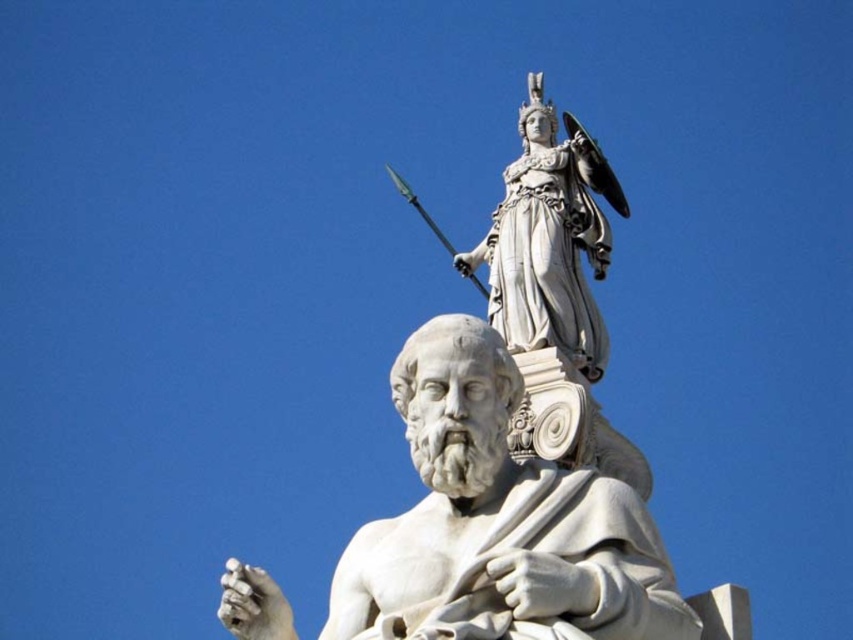
You are standing in front of the two statues. The point marked at coordinates (497, 522) is part of which statue?

The point marked at coordinates (497, 522) is on the white marble statue at center.

You are an architect designing a new plaza and need to place a new sculpture exactly at coordinates point 0.817, 0.584. The existing white marble statue at center is already located there. Can you place your new sculpture at that exact point without moving the existing statue?

The white marble statue at center is already located at point (497, 522), so you cannot place the new sculpture at that exact point without moving the existing statue.

You are an art student analyzing the composition of the two statues in the image. Which statue is positioned closer to the viewer, the white marble statue at center or the white marble statue at upper center?

The white marble statue at center is positioned closer to the viewer because it is in front of the white marble statue at upper center.